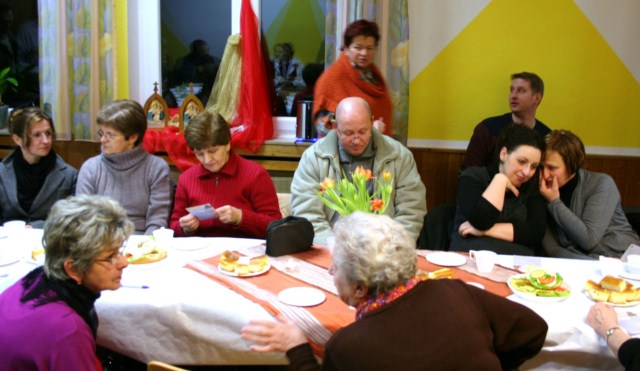
At what (x,y) coordinates should I click in order to perform the action: click on plate of bread on right side. Please return your answer as a coordinate pair (x, y). The image size is (640, 371). Looking at the image, I should click on (619, 291).